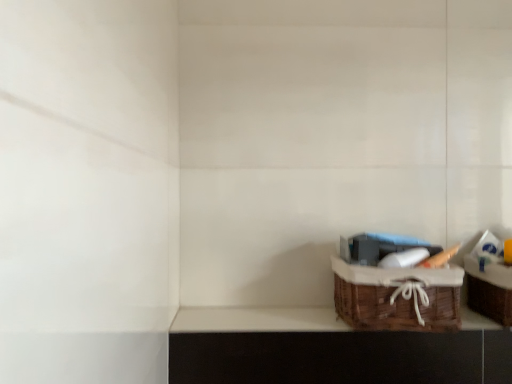
Where is `vacant area on top of woven brown picnic basket at lower right (from a real-world perspective)`? The height and width of the screenshot is (384, 512). vacant area on top of woven brown picnic basket at lower right (from a real-world perspective) is located at coordinates (394, 262).